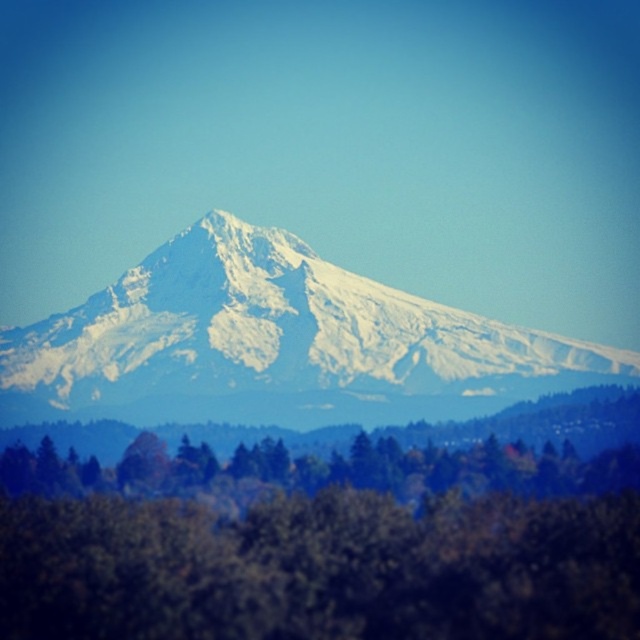
You are standing at the base of the mountain and see two points marked on the mountain slope. The first point is at coordinates point [147,529] and the second is at point [452,388]. Which point is closer to you?

Point [147,529] is further to the camera than point [452,388], so the point closer to you is point [452,388].